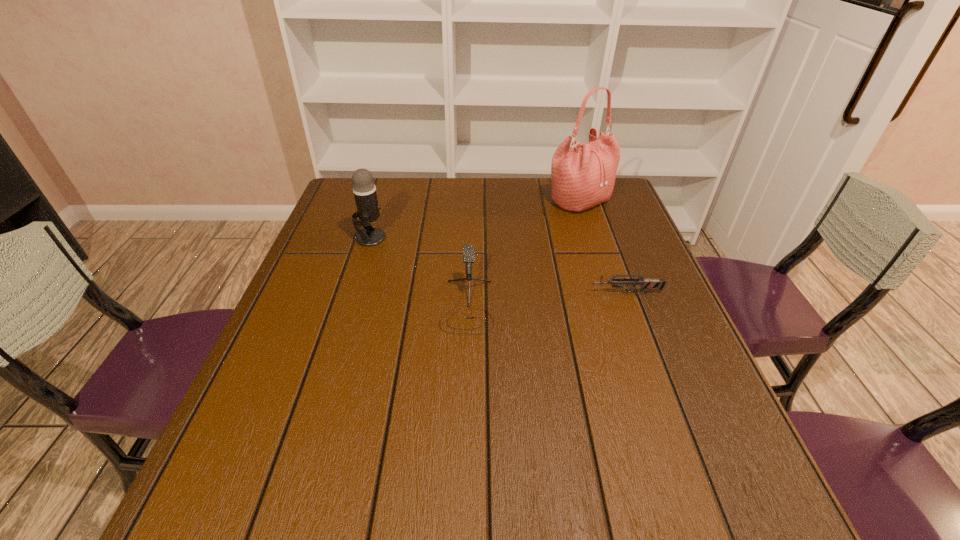
Where is `free space located 0.240m aimed along the barrel of the shortest object`? The width and height of the screenshot is (960, 540). free space located 0.240m aimed along the barrel of the shortest object is located at coordinates click(489, 293).

The height and width of the screenshot is (540, 960). I want to click on free space located aimed along the barrel of the shortest object, so click(501, 293).

Identify the location of free space located 0.100m aimed along the barrel of the shortest object. Image resolution: width=960 pixels, height=540 pixels. (546, 293).

Where is `object that is at the far edge`? The width and height of the screenshot is (960, 540). object that is at the far edge is located at coordinates (583, 175).

Identify the location of object present at the left edge. (364, 189).

At what (x,y) coordinates should I click in order to perform the action: click on handbag positioned at the right edge. Please return your answer as a coordinate pair (x, y). Image resolution: width=960 pixels, height=540 pixels. Looking at the image, I should click on (583, 175).

This screenshot has height=540, width=960. I want to click on gun at the right edge, so click(x=645, y=284).

Identify the location of object that is at the far right corner. This screenshot has width=960, height=540. (583, 175).

Locate an element on the screen. This screenshot has width=960, height=540. vacant space at the far edge is located at coordinates (463, 200).

Identify the location of free spot at the near edge of the desktop. (351, 524).